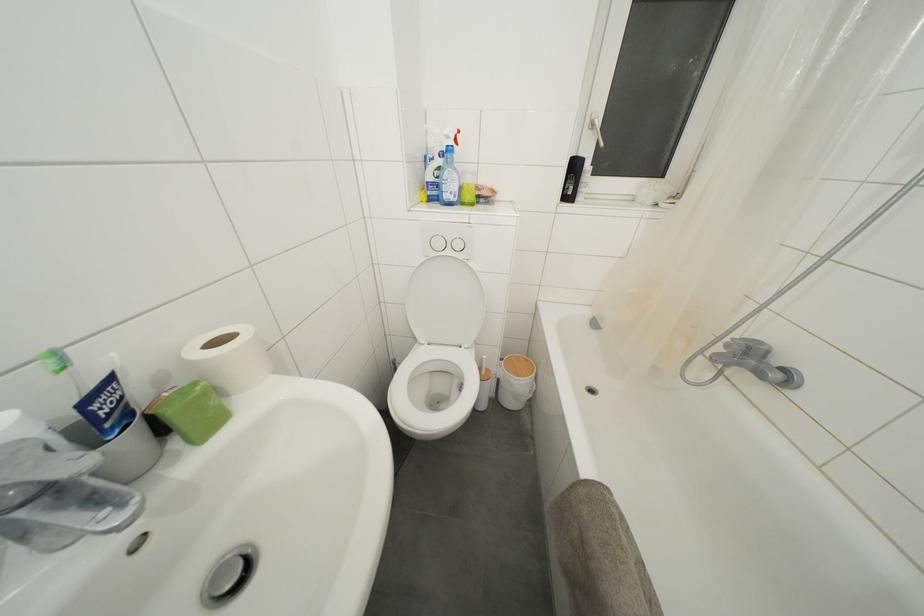
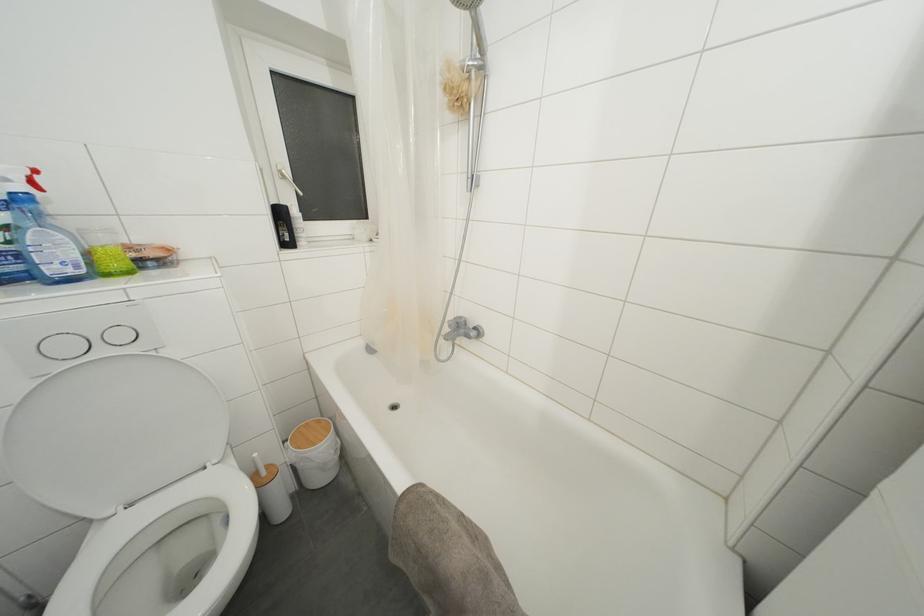
Where in the second image is the point corresponding to pixel 590 485 from the first image?

(407, 498)